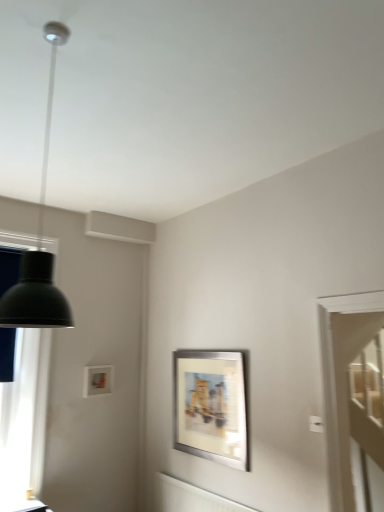
Question: Is matte white picture frame at upper left, which is counted as the second picture frame, starting from the front, at the back of matte black lampshade at left?

Choices:
 (A) no
 (B) yes

Answer: (A)

Question: From the image's perspective, is matte black lampshade at left located above matte white picture frame at upper left, which is counted as the second picture frame, starting from the front?

Choices:
 (A) yes
 (B) no

Answer: (A)

Question: Are matte black lampshade at left and matte white picture frame at upper left, which is counted as the second picture frame, starting from the front, making contact?

Choices:
 (A) no
 (B) yes

Answer: (A)

Question: Is matte black lampshade at left at the left side of matte white picture frame at upper left, which is counted as the second picture frame, starting from the front?

Choices:
 (A) no
 (B) yes

Answer: (B)

Question: Is matte black lampshade at left behind matte white picture frame at upper left, which is counted as the second picture frame, starting from the front?

Choices:
 (A) yes
 (B) no

Answer: (B)

Question: Is point (11, 504) closer or farther from the camera than point (8, 497)?

Choices:
 (A) farther
 (B) closer

Answer: (B)

Question: In the image, is matte black table at lower left positioned in front of or behind matte black lampshade at left?

Choices:
 (A) behind
 (B) front

Answer: (B)

Question: Is matte black table at lower left to the left or to the right of matte black lampshade at left in the image?

Choices:
 (A) right
 (B) left

Answer: (A)

Question: From the image's perspective, is matte black table at lower left located above or below matte black lampshade at left?

Choices:
 (A) below
 (B) above

Answer: (A)

Question: Considering the relative positions of transparent glass door at right and matte black lampshade at left in the image provided, is transparent glass door at right to the left or to the right of matte black lampshade at left?

Choices:
 (A) right
 (B) left

Answer: (A)

Question: Do you think transparent glass door at right is within matte black lampshade at left, or outside of it?

Choices:
 (A) inside
 (B) outside

Answer: (B)

Question: From their relative heights in the image, would you say transparent glass door at right is taller or shorter than matte black lampshade at left?

Choices:
 (A) tall
 (B) short

Answer: (B)

Question: From a real-world perspective, is transparent glass door at right physically located above or below matte black lampshade at left?

Choices:
 (A) below
 (B) above

Answer: (A)

Question: Visually, is silver metallic picture frame at center, the 1th picture frame viewed from the front, positioned to the left or to the right of matte white picture frame at upper left, which is counted as the second picture frame, starting from the front?

Choices:
 (A) left
 (B) right

Answer: (B)

Question: Is silver metallic picture frame at center, the first picture frame in the right-to-left sequence, bigger or smaller than matte white picture frame at upper left, marked as the 1th picture frame in a back-to-front arrangement?

Choices:
 (A) small
 (B) big

Answer: (B)